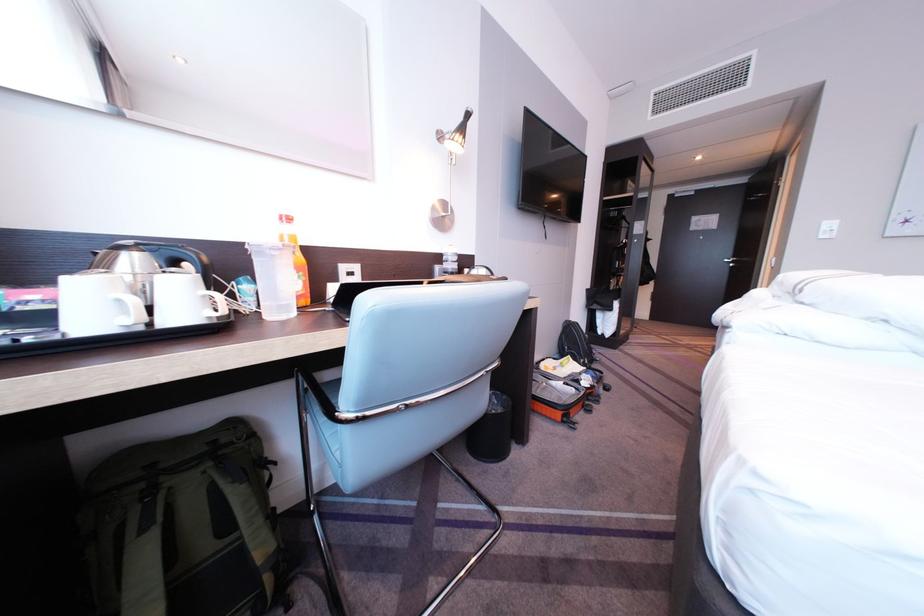
Locate an element on the screen. orange plastic bottle is located at coordinates (298, 270).